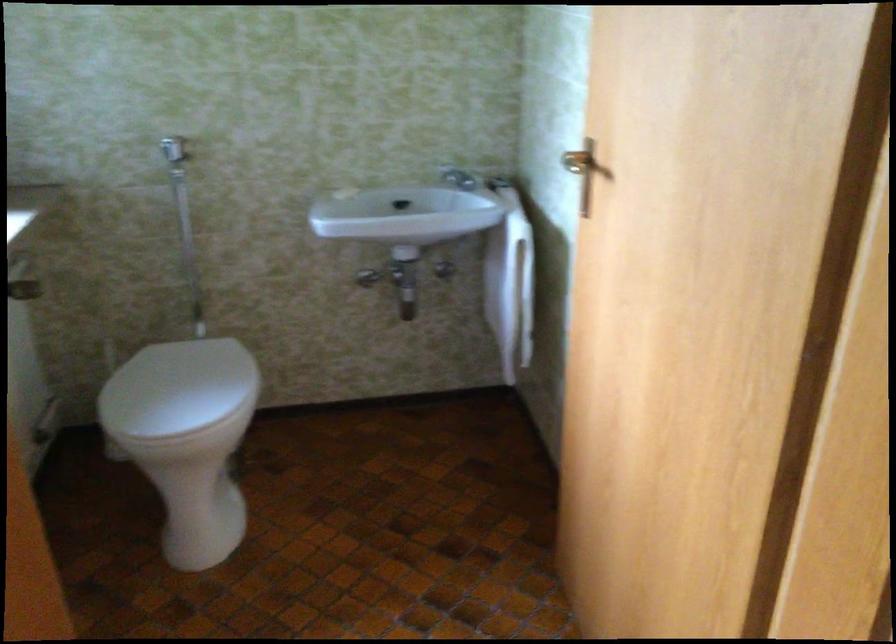
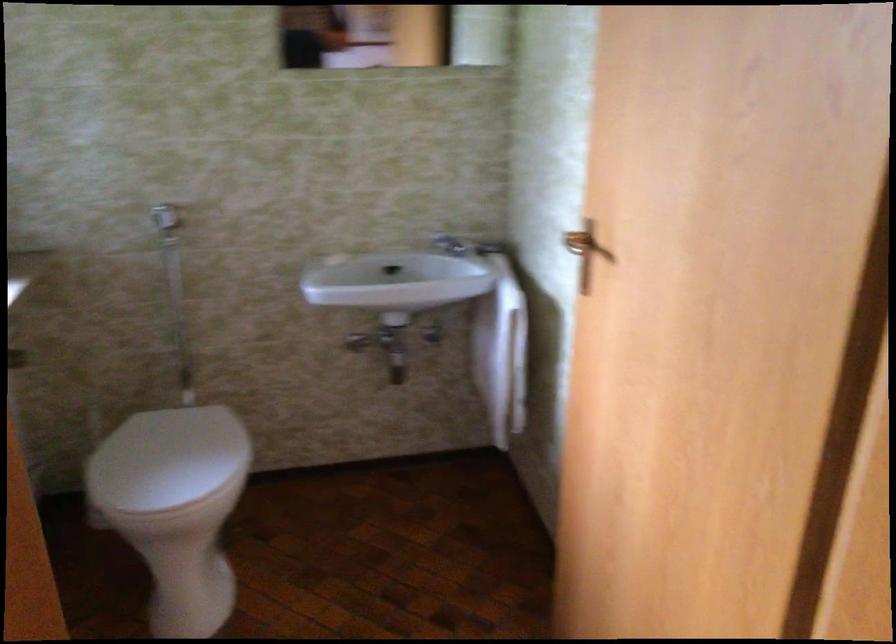
Locate, in the second image, the point that corresponds to point (459, 180) in the first image.

(450, 245)